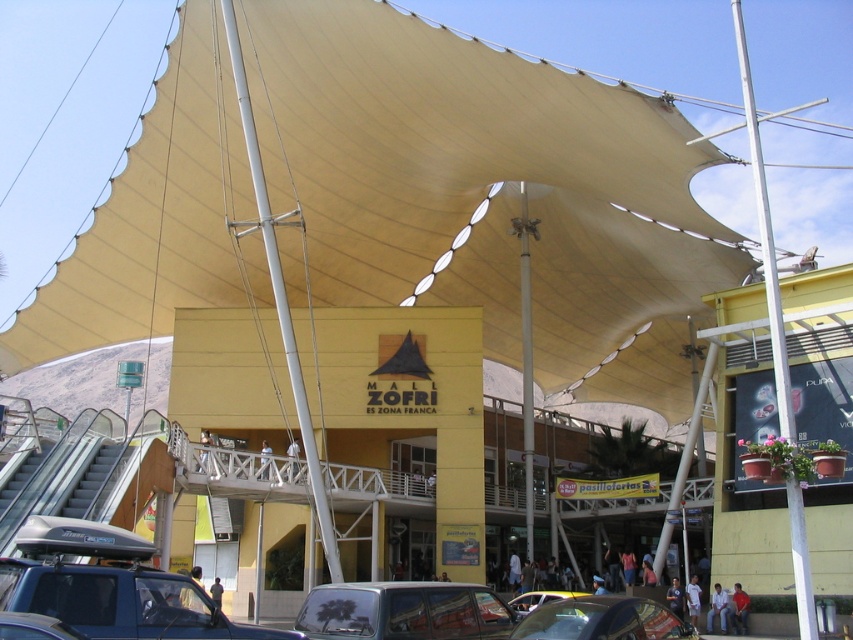
You are a delivery driver parking your shiny black car at center in the mall parking lot. You need to ensure that your car does not hit the white metallic pole at right when backing out. Based on the scene, is the pole positioned in a way that could potentially block your exit?

The white metallic pole at right is above the shiny black car at center, meaning it is positioned higher up and likely not in the direct path of the car when backing out. Therefore, the pole should not block your exit.

You are a parking attendant at Mall Zofri and need to determine if a delivery truck that is 2 meters tall can pass under the curved beige canopy. The silver metallic car at center and shiny black car at center are parked under the canopy. Which car, if any, would block the truck from passing due to its height?

The silver metallic car at center is much taller than the shiny black car at center. Since the delivery truck is 2 meters tall, the silver metallic car at center would block the truck from passing due to its greater height.